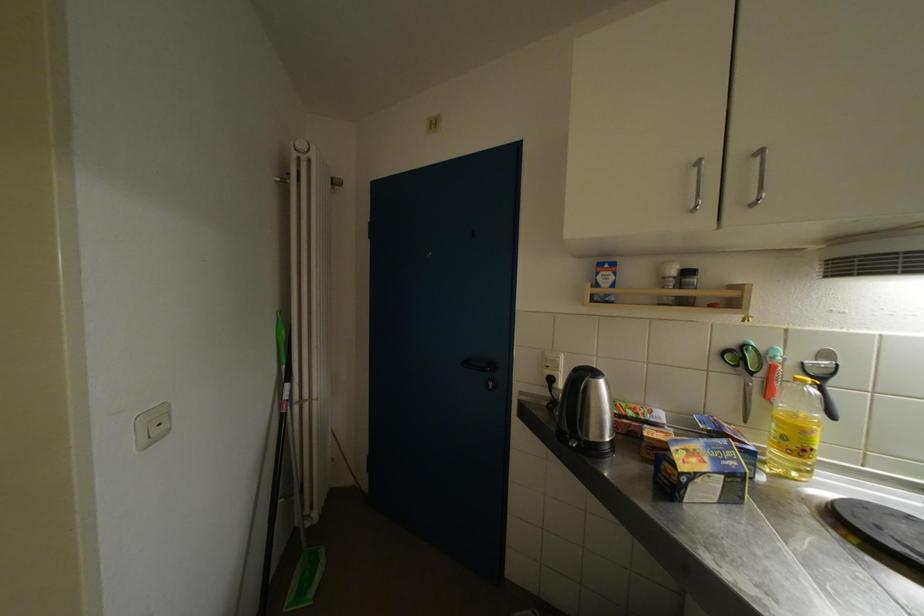
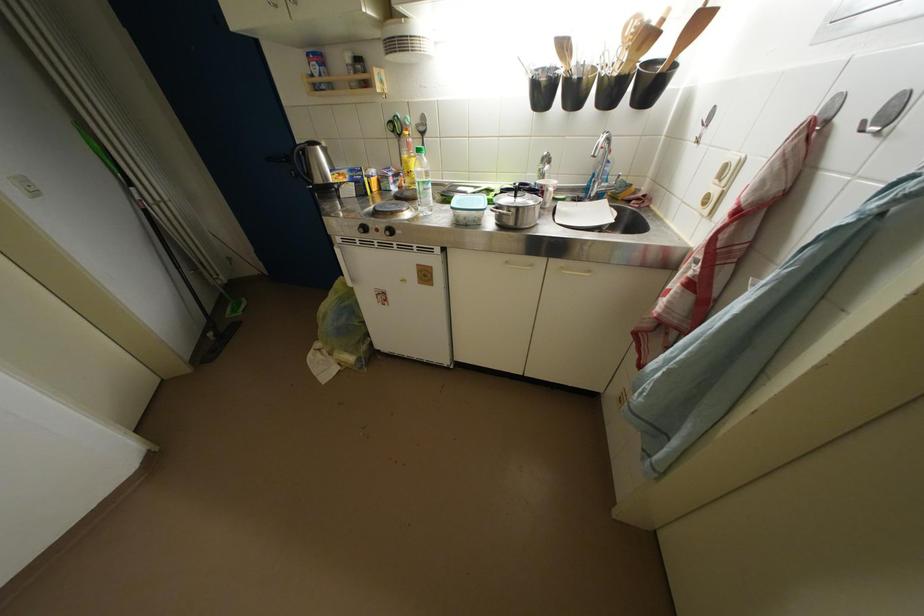
The point at [294,400] is marked in the first image. Where is the corresponding point in the second image?

(144, 201)